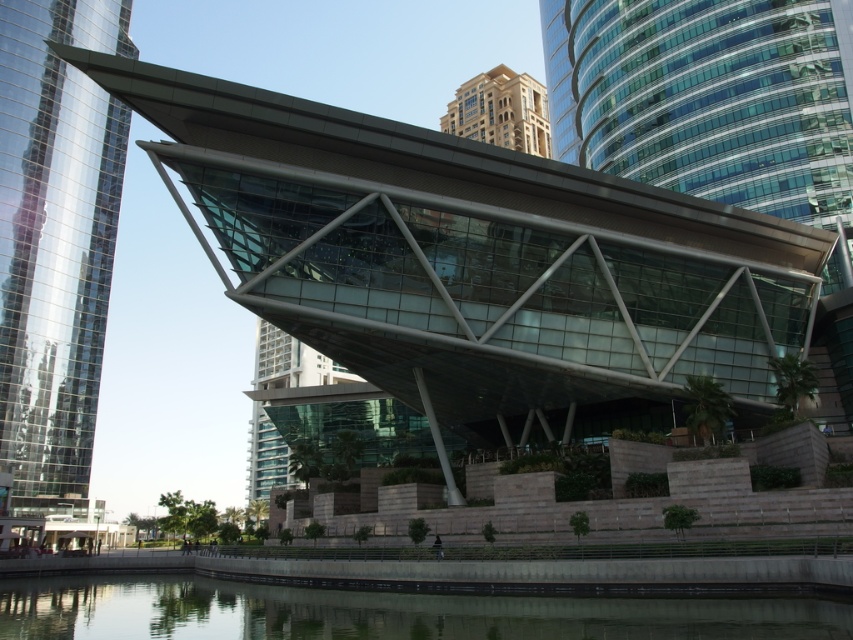
Question: Does glassy reflective tower at left appear over golden beige stone building at upper center?

Choices:
 (A) no
 (B) yes

Answer: (A)

Question: Which object is farther from the camera taking this photo?

Choices:
 (A) transparent glass water at lower center
 (B) glassy reflective tower at left
 (C) golden beige stone building at upper center

Answer: (C)

Question: Which object is farther from the camera taking this photo?

Choices:
 (A) glassy reflective tower at left
 (B) transparent glass water at lower center
 (C) golden beige stone building at upper center

Answer: (C)

Question: Is glassy reflective tower at left to the right of golden beige stone building at upper center from the viewer's perspective?

Choices:
 (A) yes
 (B) no

Answer: (B)

Question: Can you confirm if glassy reflective tower at left is thinner than golden beige stone building at upper center?

Choices:
 (A) yes
 (B) no

Answer: (A)

Question: Which is nearer to the golden beige stone building at upper center?

Choices:
 (A) transparent glass water at lower center
 (B) glassy reflective tower at left

Answer: (B)